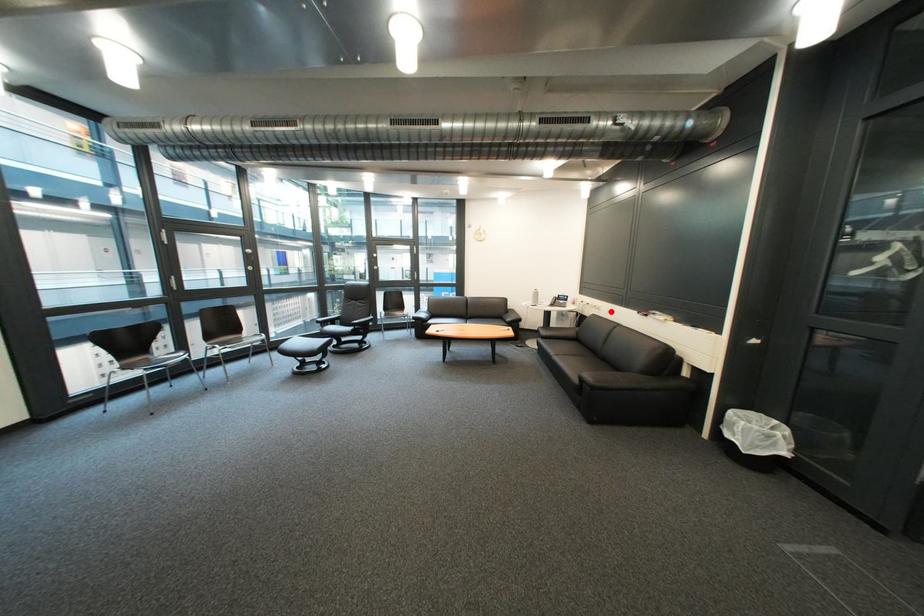
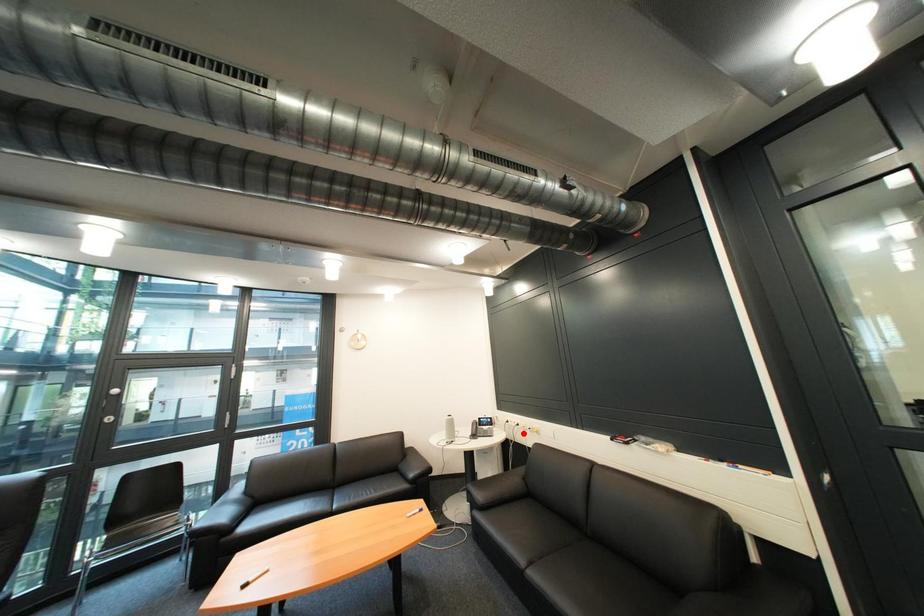
I am providing you with two images of the same scene from different viewpoints. A red point is marked on the first image and another point is marked on the second image. Are the points marked in image1 and image2 representing the same 3D position?

No